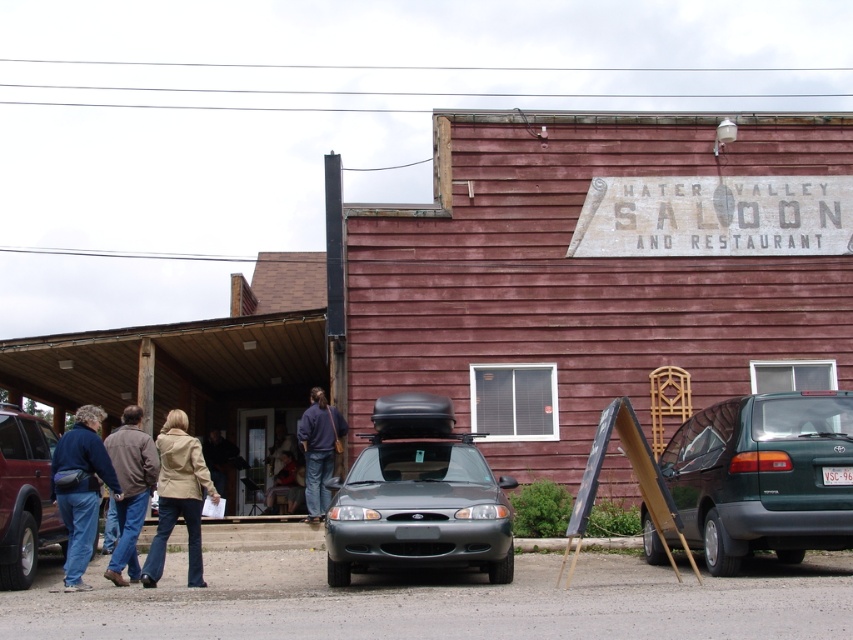
Which is in front, point (724, 490) or point (294, 483)?

Point (724, 490) is more forward.

Which is more to the right, green matte van at right or denim jacket at lower center?

green matte van at right

This screenshot has width=853, height=640. Describe the element at coordinates (764, 476) in the screenshot. I see `green matte van at right` at that location.

Locate an element on the screen. The width and height of the screenshot is (853, 640). green matte van at right is located at coordinates (764, 476).

Does beige leather jacket at lower center appear on the left side of brown leather jacket at lower left?

In fact, beige leather jacket at lower center is to the right of brown leather jacket at lower left.

Is beige leather jacket at lower center closer to the viewer compared to brown leather jacket at lower left?

Yes.

Identify the location of beige leather jacket at lower center. The image size is (853, 640). (178, 497).

Does matte gray car at center have a greater width compared to denim jacket at left?

Correct, the width of matte gray car at center exceeds that of denim jacket at left.

Does matte gray car at center appear over denim jacket at left?

Indeed, matte gray car at center is positioned over denim jacket at left.

Is point (494, 504) positioned behind point (96, 444)?

No, (494, 504) is closer to viewer.

Locate an element on the screen. This screenshot has width=853, height=640. matte gray car at center is located at coordinates (418, 497).